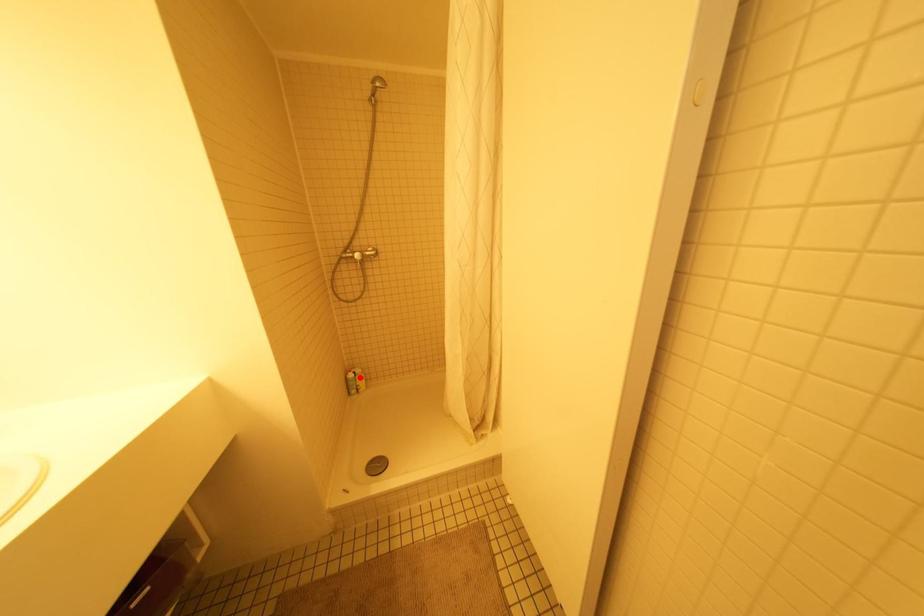
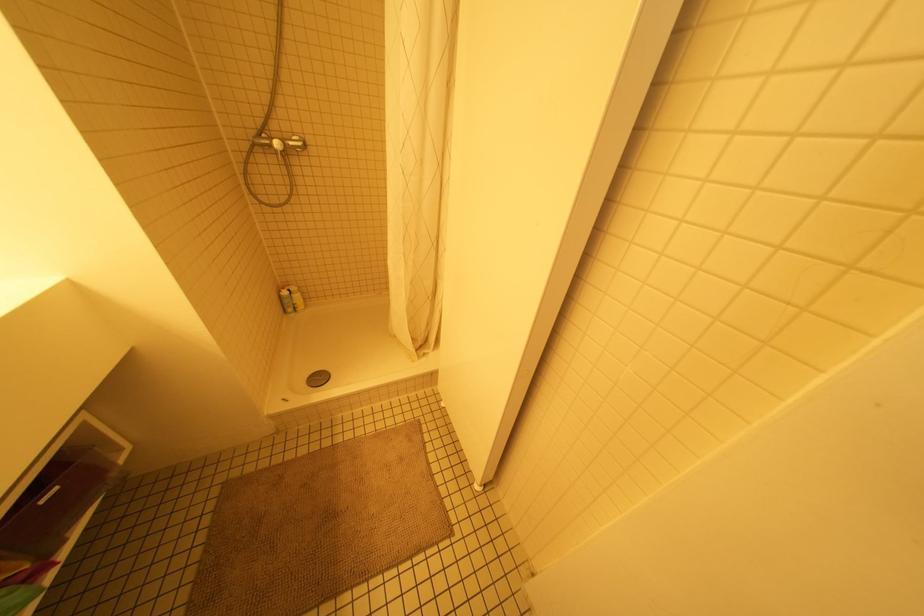
The point at the highlighted location is marked in the first image. Where is the corresponding point in the second image?

(297, 296)